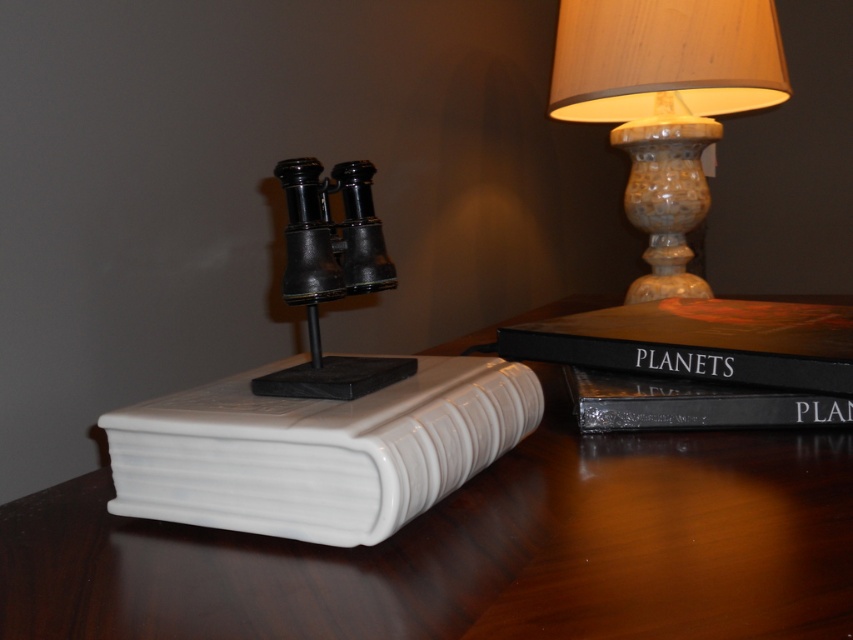
Is matte beige lampshade at upper right taller than black matte/finish binoculars at center?

Correct, matte beige lampshade at upper right is much taller as black matte/finish binoculars at center.

Does matte beige lampshade at upper right have a greater width compared to black matte/finish binoculars at center?

Correct, the width of matte beige lampshade at upper right exceeds that of black matte/finish binoculars at center.

What do you see at coordinates (665, 104) in the screenshot? The width and height of the screenshot is (853, 640). I see `matte beige lampshade at upper right` at bounding box center [665, 104].

Where is `matte beige lampshade at upper right`? The width and height of the screenshot is (853, 640). matte beige lampshade at upper right is located at coordinates (665, 104).

Does black matte/finish binoculars at center have a greater width compared to hardcover book at right?

Incorrect, black matte/finish binoculars at center's width does not surpass hardcover book at right's.

Where is `black matte/finish binoculars at center`? The image size is (853, 640). black matte/finish binoculars at center is located at coordinates (331, 276).

Identify the location of black matte/finish binoculars at center. The image size is (853, 640). (331, 276).

Between point (805, 346) and point (260, 380), which one is positioned behind?

The point (805, 346) is more distant.

Is black matte book at upper right to the right of black matte/finish binoculars at center from the viewer's perspective?

Yes, black matte book at upper right is to the right of black matte/finish binoculars at center.

Is point (646, 314) positioned behind point (315, 252)?

Yes, it is behind point (315, 252).

The height and width of the screenshot is (640, 853). What are the coordinates of `black matte book at upper right` in the screenshot? It's located at (700, 340).